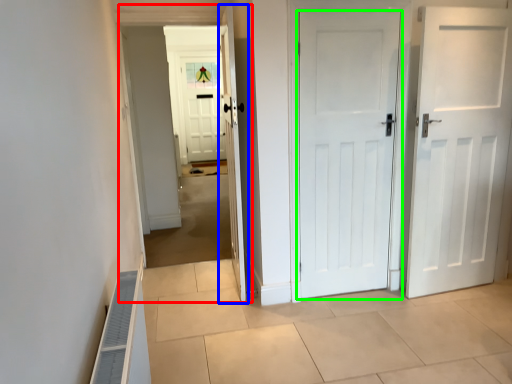
Question: Based on their relative distances, which object is nearer to corridor (highlighted by a red box)? Choose from door (highlighted by a blue box) and door (highlighted by a green box).

Choices:
 (A) door
 (B) door

Answer: (A)